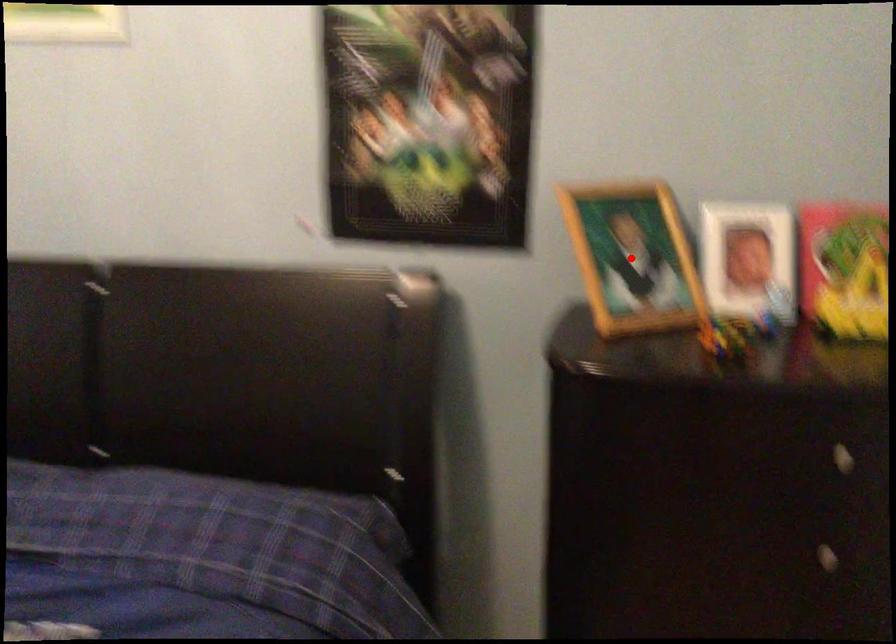
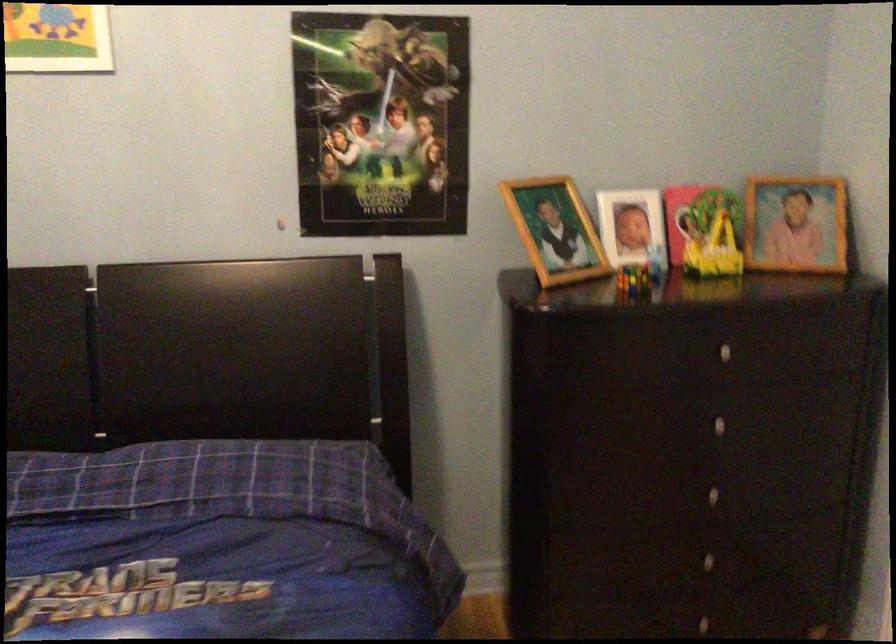
Question: I am providing you with two images of the same scene from different viewpoints. A red point is shown in image1. For the corresponding object point in image2, is it positioned nearer or farther from the camera?

Choices:
 (A) Nearer
 (B) Farther

Answer: (B)